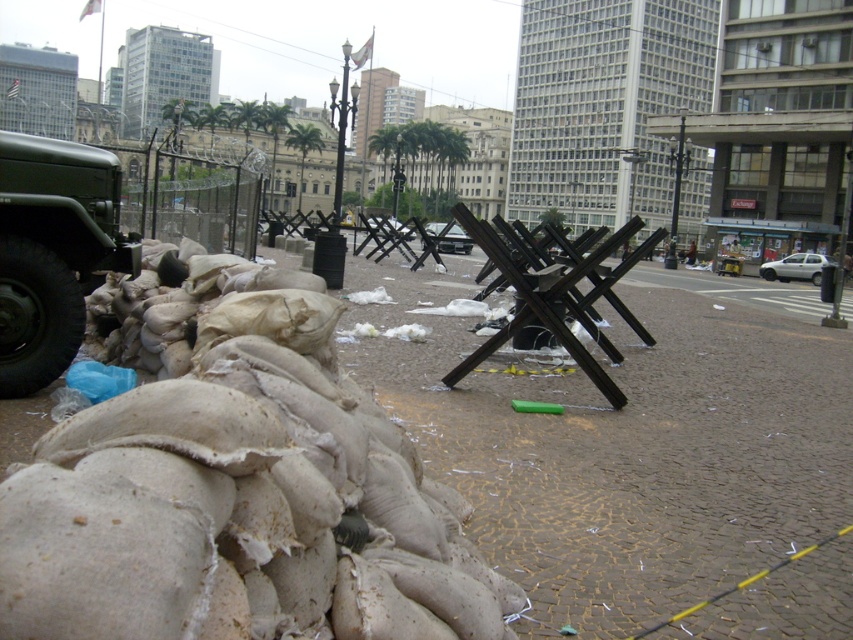
Question: Does matte green military vehicle at left appear on the left side of metallic silver car at center?

Choices:
 (A) yes
 (B) no

Answer: (A)

Question: In this image, where is matte green military vehicle at left located relative to metallic silver car at center?

Choices:
 (A) right
 (B) left

Answer: (B)

Question: Which point is farther to the camera?

Choices:
 (A) white matte car at right
 (B) matte green military vehicle at left
 (C) metallic silver car at center

Answer: (A)

Question: Which object is positioned farthest from the white matte car at right?

Choices:
 (A) metallic silver car at center
 (B) matte green military vehicle at left

Answer: (B)

Question: Is matte green military vehicle at left to the right of white matte car at right from the viewer's perspective?

Choices:
 (A) no
 (B) yes

Answer: (A)

Question: Which point is closer to the camera?

Choices:
 (A) white matte car at right
 (B) matte green military vehicle at left
 (C) metallic silver car at center

Answer: (B)